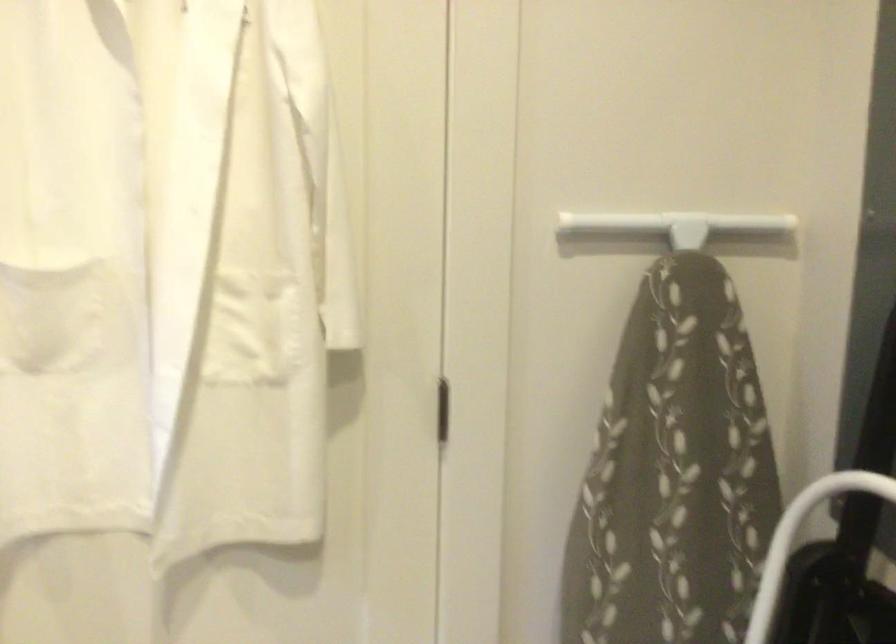
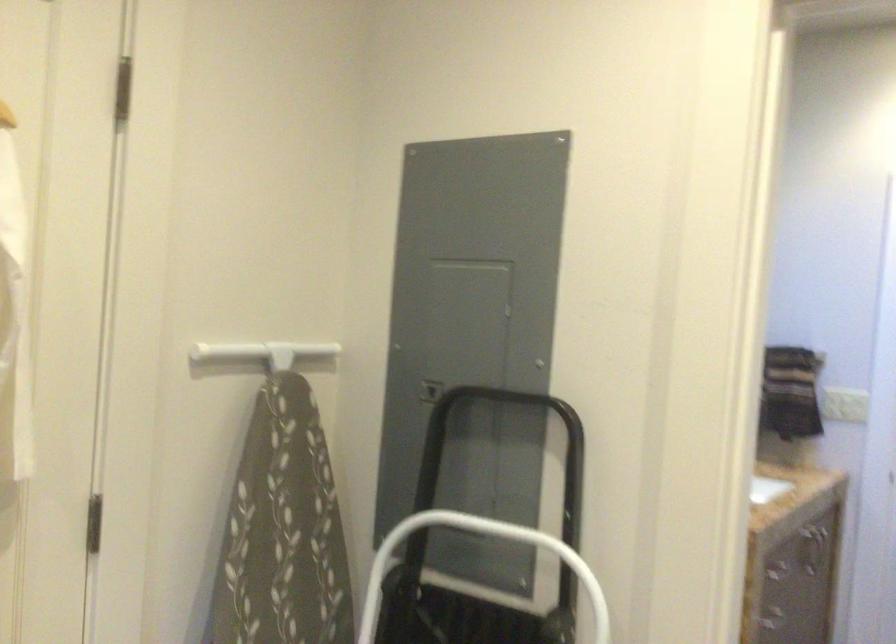
Question: The images are taken continuously from a first-person perspective. In which direction is your viewpoint rotating?

Choices:
 (A) Left
 (B) Right
 (C) Up
 (D) Down

Answer: (B)